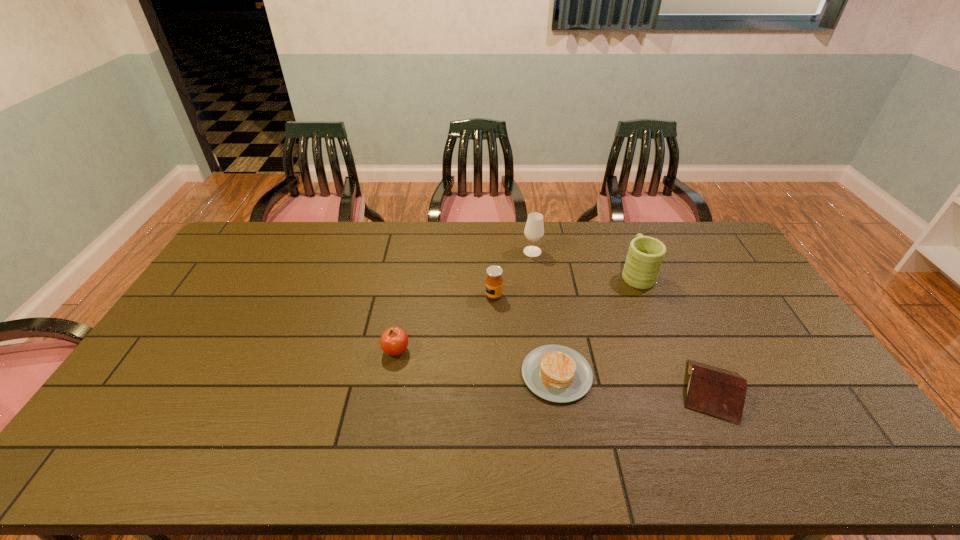
Where is `vacant space situated 0.300m on the front-facing side of the honey`? The width and height of the screenshot is (960, 540). vacant space situated 0.300m on the front-facing side of the honey is located at coordinates (396, 295).

Find the location of a particular element. The height and width of the screenshot is (540, 960). vacant area situated on the front-facing side of the honey is located at coordinates (464, 295).

At what (x,y) coordinates should I click in order to perform the action: click on vacant space situated on the front-facing side of the honey. Please return your answer as a coordinate pair (x, y). Looking at the image, I should click on [x=386, y=295].

Locate an element on the screen. This screenshot has width=960, height=540. vacant space located 0.250m on the back of the apple is located at coordinates (408, 285).

In order to click on vacant region located 0.250m on the back of the book in this screenshot , I will do `click(670, 300)`.

The height and width of the screenshot is (540, 960). Identify the location of free region located on the back of the pancake. (548, 320).

This screenshot has width=960, height=540. I want to click on glass that is at the far edge, so click(x=534, y=230).

Where is `mug situated at the far edge`? mug situated at the far edge is located at coordinates (643, 262).

Where is `vacant region at the far edge`? vacant region at the far edge is located at coordinates (516, 221).

You are a GUI agent. You are given a task and a screenshot of the screen. Output one action in this format:
    pyautogui.click(x=<x>, y=<y>)
    Task: Click on the free region at the near edge of the desktop
    The image size is (960, 540).
    Given the screenshot: What is the action you would take?
    pyautogui.click(x=691, y=439)